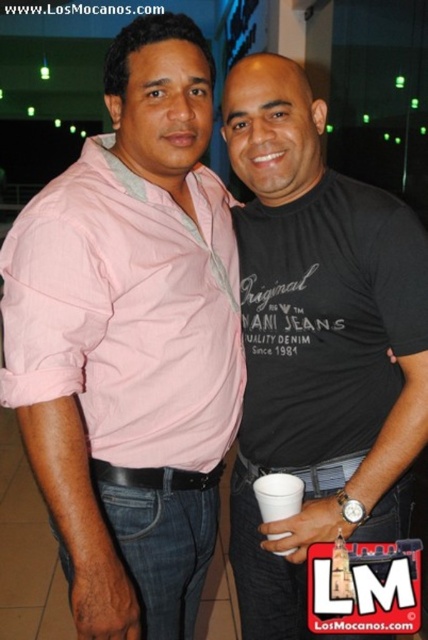
Question: Can you confirm if pink cotton shirt at center is positioned to the right of black cotton t-shirt at center?

Choices:
 (A) yes
 (B) no

Answer: (B)

Question: Estimate the real-world distances between objects in this image. Which object is closer to the black cotton t-shirt at center?

Choices:
 (A) white paper cup at center
 (B) pink cotton shirt at center

Answer: (B)

Question: Does pink cotton shirt at center come in front of black leather belt at center?

Choices:
 (A) no
 (B) yes

Answer: (B)

Question: Which of the following is the closest to the observer?

Choices:
 (A) (80, 296)
 (B) (288, 513)

Answer: (A)

Question: Can you confirm if black cotton t-shirt at center is bigger than black leather belt at center?

Choices:
 (A) no
 (B) yes

Answer: (B)

Question: Which is nearer to the black leather belt at center?

Choices:
 (A) white paper cup at center
 (B) pink cotton shirt at center
 (C) black cotton t-shirt at center

Answer: (A)